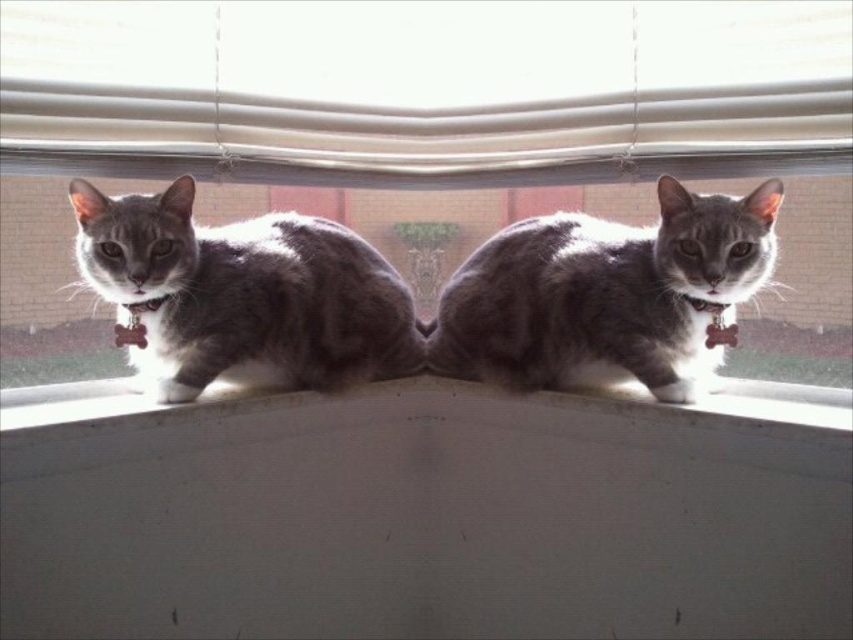
Can you confirm if gray fur cat at center is shorter than gray fur cat at left?

Yes.

Locate an element on the screen. Image resolution: width=853 pixels, height=640 pixels. gray fur cat at center is located at coordinates (606, 294).

From the picture: Which of these two, transparent glass window at center or gray fur cat at center, stands taller?

transparent glass window at center is taller.

Between transparent glass window at center and gray fur cat at center, which one is positioned lower?

Positioned lower is gray fur cat at center.

This screenshot has height=640, width=853. I want to click on transparent glass window at center, so click(456, 115).

Is transparent glass window at center positioned at the back of gray fur cat at left?

No, it is in front of gray fur cat at left.

Is transparent glass window at center wider than gray fur cat at left?

Yes, transparent glass window at center is wider than gray fur cat at left.

Is point (177, 136) closer to camera compared to point (276, 349)?

Yes, it is in front of point (276, 349).

Identify the location of transparent glass window at center. (456, 115).